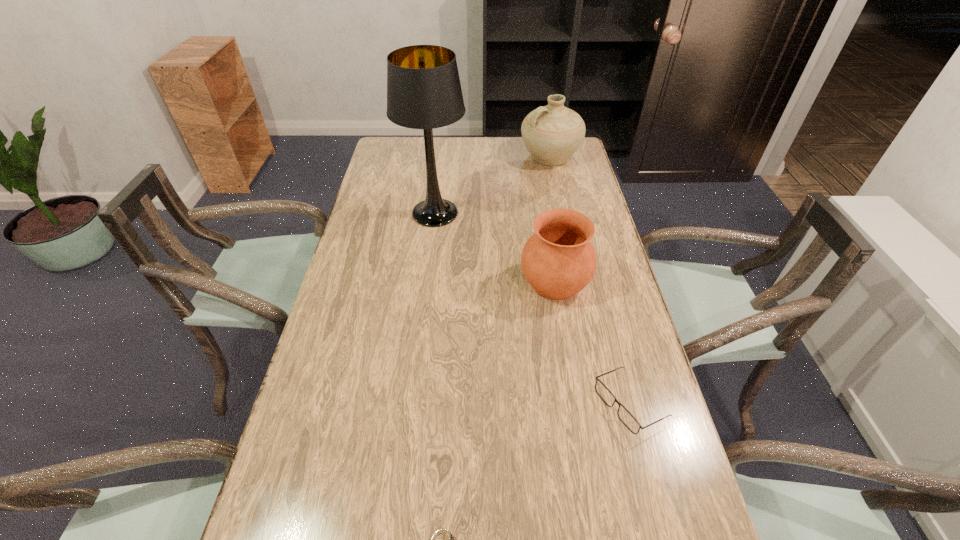
Where is `vacant space at the far right corner`? This screenshot has height=540, width=960. vacant space at the far right corner is located at coordinates (581, 167).

Locate an element on the screen. Image resolution: width=960 pixels, height=540 pixels. vacant space that's between the table lamp and the second shortest object is located at coordinates (532, 308).

The image size is (960, 540). What are the coordinates of `vacant space that is in between the tallest object and the farther pottery` in the screenshot? It's located at (492, 185).

Find the location of a particular element. The image size is (960, 540). free area in between the tallest object and the spectacles is located at coordinates (532, 308).

Locate an element on the screen. The height and width of the screenshot is (540, 960). free space between the second shortest object and the second farthest object is located at coordinates (532, 308).

Identify the location of blank region between the third shortest object and the tallest object. (494, 248).

This screenshot has height=540, width=960. In order to click on object that is the second closest to the table lamp in this screenshot , I will do `click(552, 134)`.

Identify which object is the nearest to the nearest object. Please provide its 2D coordinates. Your answer should be formatted as a tuple, i.e. [(x, y)], where the tuple contains the x and y coordinates of a point satisfying the conditions above.

[(625, 416)]